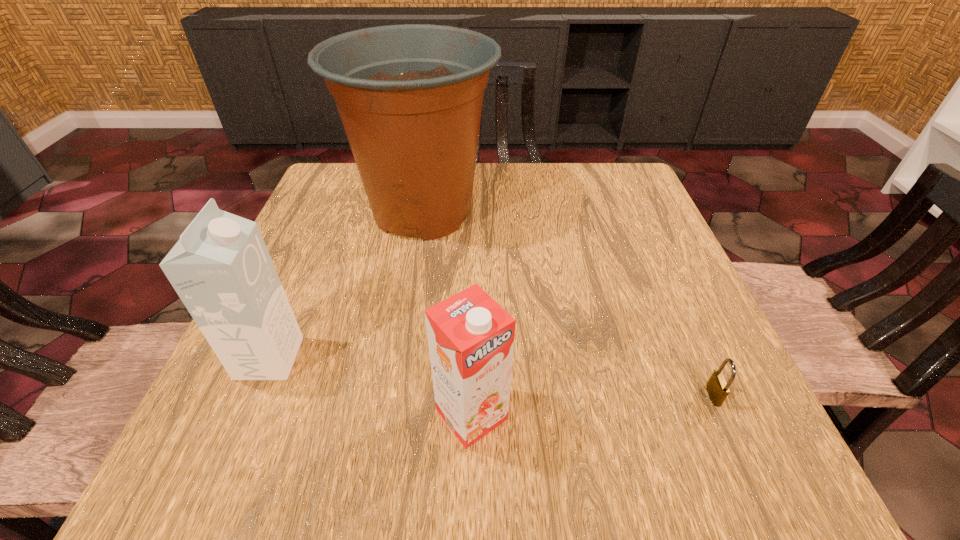
Identify the location of vacant area situated 0.100m on the back of the third tallest object. (473, 334).

The image size is (960, 540). I want to click on free region located 0.110m on the left of the shortest object, so click(636, 395).

Identify the location of object that is at the far edge. (410, 96).

The width and height of the screenshot is (960, 540). Identify the location of object that is positioned at the near edge. (470, 336).

Locate an element on the screen. flowerpot that is positioned at the left edge is located at coordinates (x=410, y=96).

Locate an element on the screen. carton at the left edge is located at coordinates [x=221, y=269].

Identify the location of object at the right edge. This screenshot has width=960, height=540. (717, 386).

The height and width of the screenshot is (540, 960). I want to click on object present at the far left corner, so click(410, 96).

In the image, there is a desktop. In order to click on vacant space at the far edge in this screenshot , I will do `click(563, 188)`.

You are a GUI agent. You are given a task and a screenshot of the screen. Output one action in this format:
    pyautogui.click(x=<x>, y=<y>)
    Task: Click on the vacant space at the near edge of the desktop
    The image size is (960, 540).
    Given the screenshot: What is the action you would take?
    pyautogui.click(x=396, y=485)